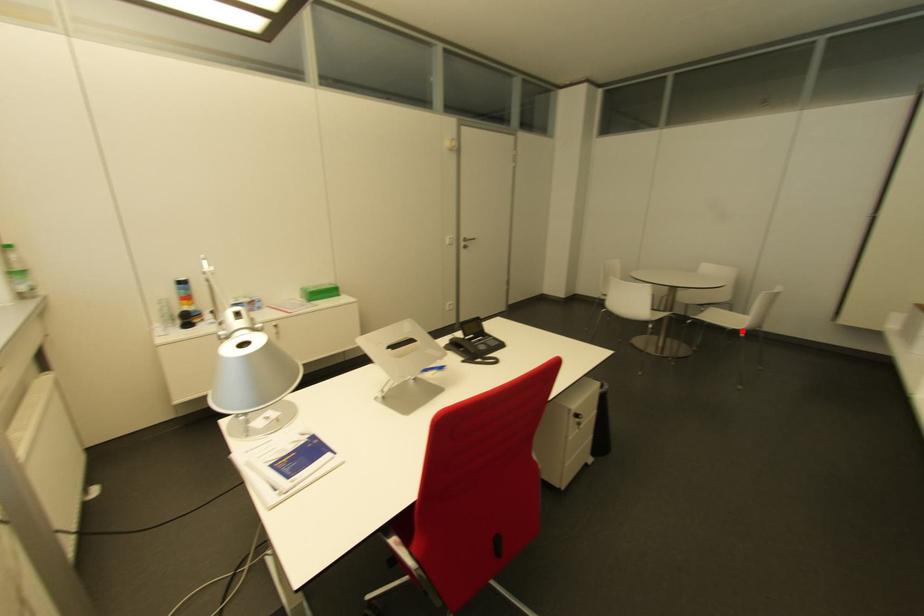
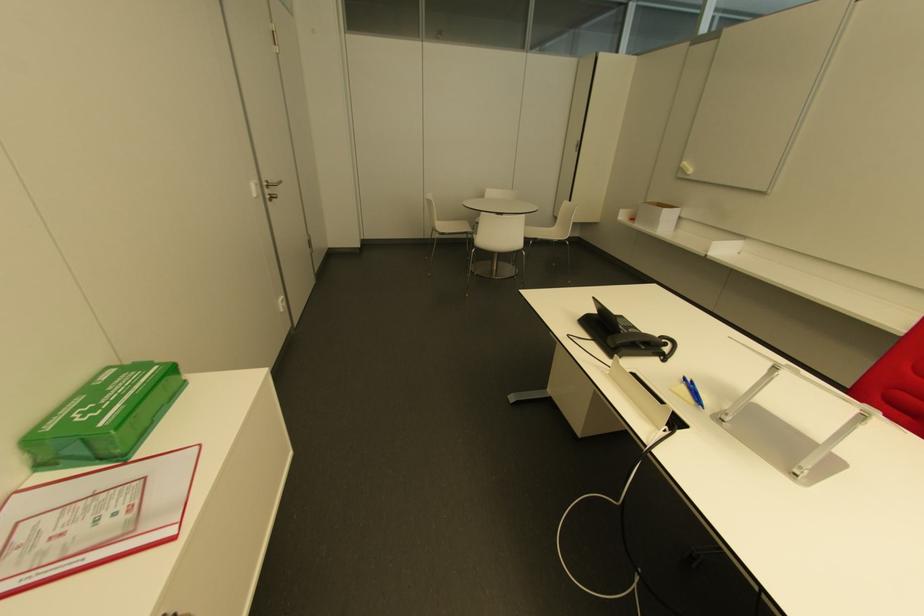
Where in the second image is the point corresponding to the highlighted location from the first image?

(565, 240)